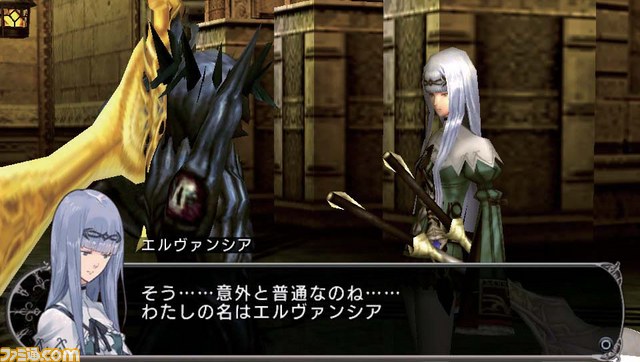
Where is `lantern`? The width and height of the screenshot is (640, 362). lantern is located at coordinates 20,16.